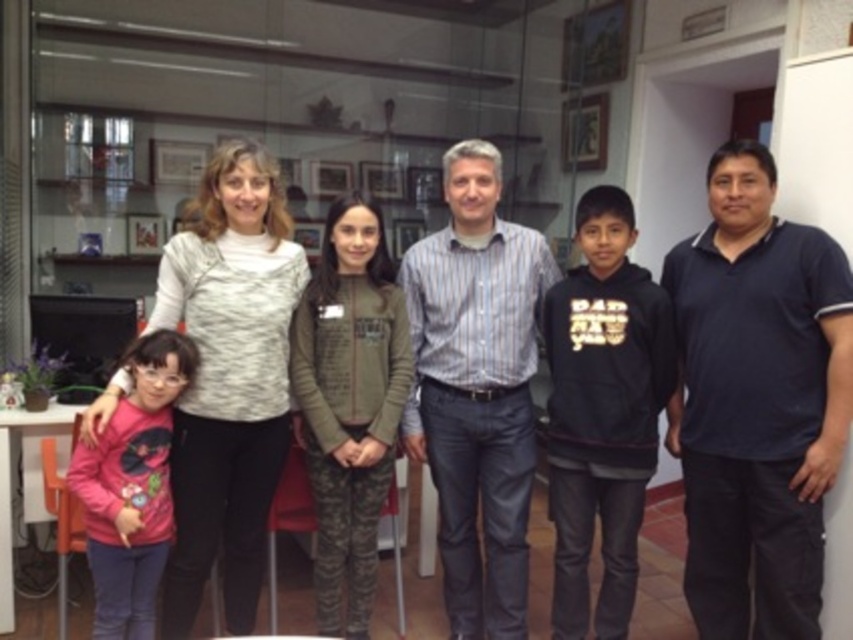
Can you confirm if pink matte shirt at left is wider than pink fabric at left?

Yes, pink matte shirt at left is wider than pink fabric at left.

Does pink matte shirt at left have a lesser height compared to pink fabric at left?

In fact, pink matte shirt at left may be taller than pink fabric at left.

Does point (259, 339) come closer to viewer compared to point (685, 465)?

Yes, it is in front of point (685, 465).

I want to click on pink matte shirt at left, so click(228, 378).

Which is behind, point (126, 365) or point (670, 435)?

Positioned behind is point (670, 435).

Does point (112, 428) come behind point (612, 246)?

No, (112, 428) is in front of (612, 246).

Where is `pink fabric shirt at left`? This screenshot has width=853, height=640. pink fabric shirt at left is located at coordinates (132, 486).

Does dark blue polo shirt at right have a lesser height compared to striped cotton shirt at center?

Indeed, dark blue polo shirt at right has a lesser height compared to striped cotton shirt at center.

Does dark blue polo shirt at right appear on the left side of striped cotton shirt at center?

In fact, dark blue polo shirt at right is to the right of striped cotton shirt at center.

This screenshot has width=853, height=640. Find the location of `dark blue polo shirt at right`. dark blue polo shirt at right is located at coordinates (757, 401).

The width and height of the screenshot is (853, 640). In order to click on dark blue polo shirt at right in this screenshot , I will do `click(757, 401)`.